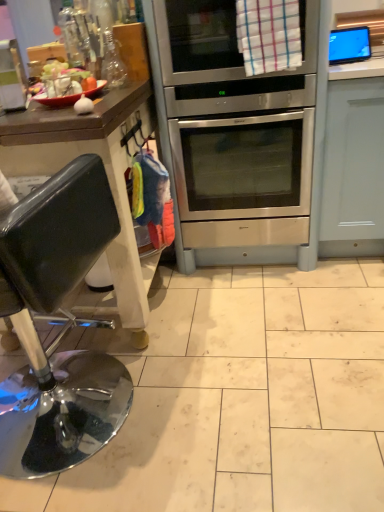
The height and width of the screenshot is (512, 384). Find the location of `free spot in front of stainless steel oven at center`. free spot in front of stainless steel oven at center is located at coordinates (262, 317).